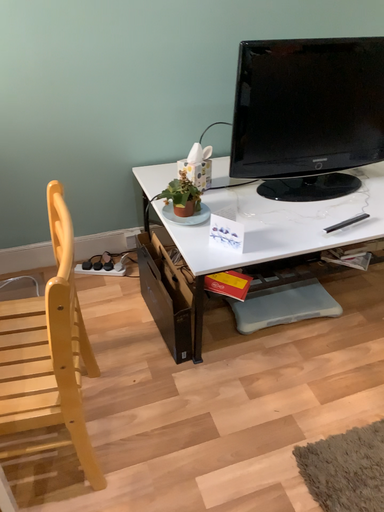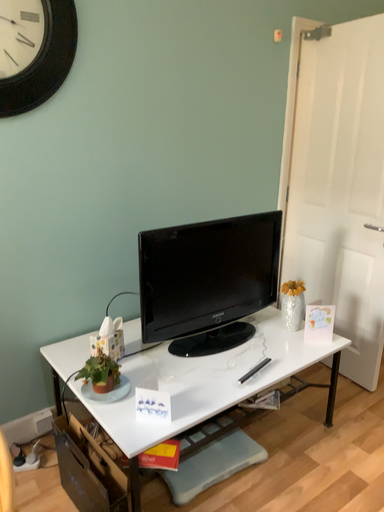
Question: Which way did the camera rotate in the video?

Choices:
 (A) rotated left
 (B) rotated right

Answer: (B)